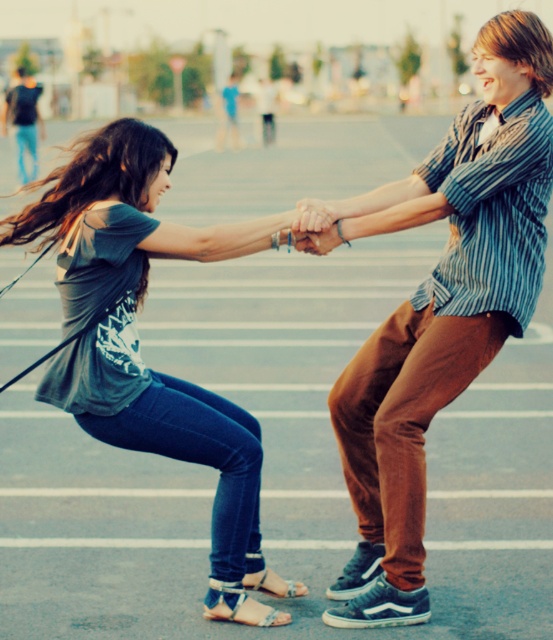
Is matte gray t-shirt at center to the right of white leather sandal at lower center from the viewer's perspective?

No, matte gray t-shirt at center is not to the right of white leather sandal at lower center.

Does matte gray t-shirt at center have a greater width compared to white leather sandal at lower center?

Yes, matte gray t-shirt at center is wider than white leather sandal at lower center.

Between point (153, 202) and point (274, 573), which one is positioned behind?

The point (274, 573) is behind.

Locate an element on the screen. Image resolution: width=553 pixels, height=640 pixels. matte gray t-shirt at center is located at coordinates (134, 321).

Which of these two, matte gray shirt at center or matte gray t-shirt at center, stands shorter?

matte gray t-shirt at center is shorter.

From the picture: Does matte gray shirt at center have a lesser width compared to matte gray t-shirt at center?

Yes.

What do you see at coordinates (439, 307) in the screenshot?
I see `matte gray shirt at center` at bounding box center [439, 307].

Image resolution: width=553 pixels, height=640 pixels. In order to click on matte gray shirt at center in this screenshot , I will do `click(439, 307)`.

Who is positioned more to the left, matte gray shirt at center or blue fabric sandal at lower center?

Positioned to the left is blue fabric sandal at lower center.

Can you confirm if matte gray shirt at center is positioned to the left of blue fabric sandal at lower center?

In fact, matte gray shirt at center is to the right of blue fabric sandal at lower center.

Is point (316, 212) behind point (257, 608)?

No.

Where is `matte gray shirt at center`? matte gray shirt at center is located at coordinates (439, 307).